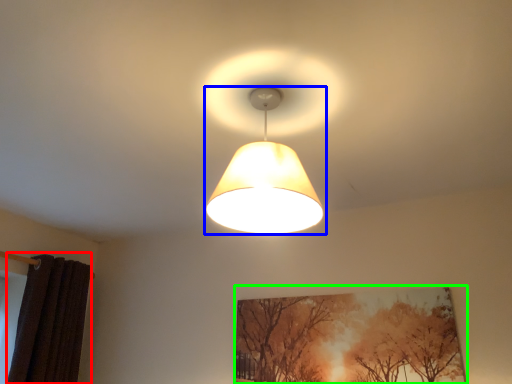
Question: Based on their relative distances, which object is nearer to curtain (highlighted by a red box)? Choose from lamp (highlighted by a blue box) and picture frame (highlighted by a green box).

Choices:
 (A) lamp
 (B) picture frame

Answer: (B)